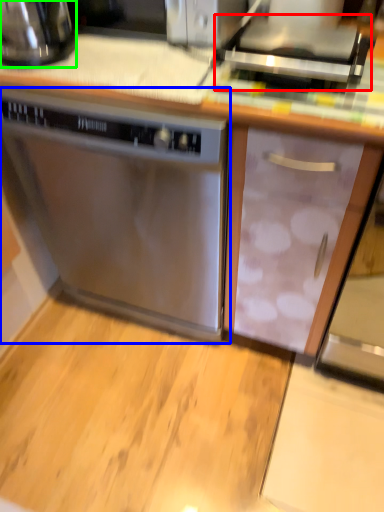
Question: Estimate the real-world distances between objects in this image. Which object is closer to appliance (highlighted by a red box), home appliance (highlighted by a blue box) or kitchen appliance (highlighted by a green box)?

Choices:
 (A) home appliance
 (B) kitchen appliance

Answer: (A)